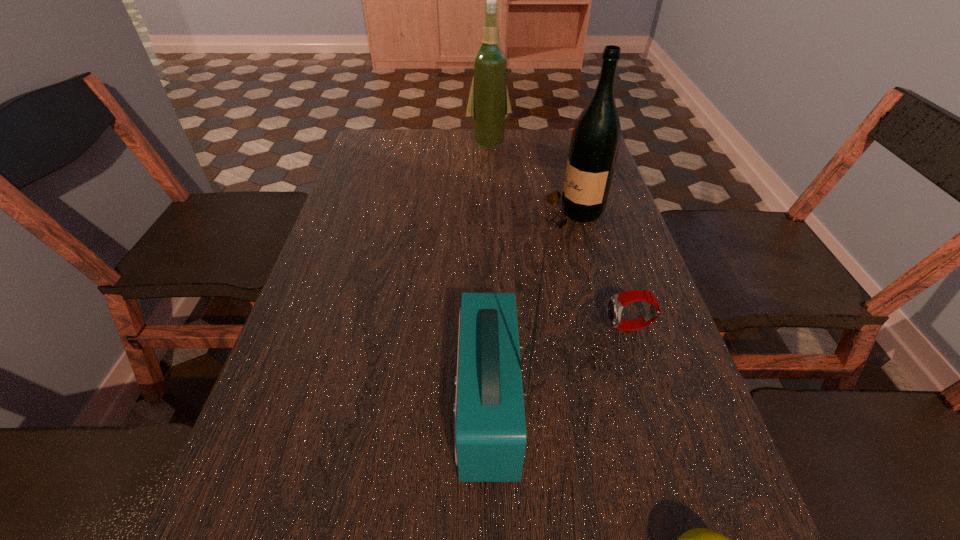
In the image, there is a desktop. At what (x,y) coordinates should I click in order to perform the action: click on blank space at the left edge. Please return your answer as a coordinate pair (x, y). Image resolution: width=960 pixels, height=540 pixels. Looking at the image, I should click on (310, 453).

At what (x,y) coordinates should I click in order to perform the action: click on free space at the right edge. Please return your answer as a coordinate pair (x, y). Image resolution: width=960 pixels, height=540 pixels. Looking at the image, I should click on (708, 500).

Locate an element on the screen. This screenshot has height=540, width=960. vacant space at the far right corner of the desktop is located at coordinates (563, 134).

This screenshot has width=960, height=540. Identify the location of free space between the right wine bottle and the farthest object. (531, 179).

Find the location of a particular element. free space that is in between the third farthest object and the left wine bottle is located at coordinates (559, 236).

You are a GUI agent. You are given a task and a screenshot of the screen. Output one action in this format:
    pyautogui.click(x=<x>, y=<y>)
    Task: Click on the empty space that is in between the nearer wine bottle and the left wine bottle
    
    Given the screenshot: What is the action you would take?
    pyautogui.click(x=531, y=179)

The width and height of the screenshot is (960, 540). Identify the location of free area in between the farthest object and the nearer wine bottle. (531, 179).

Identify the location of unoccupied position between the farthest object and the third farthest object. The width and height of the screenshot is (960, 540). (559, 236).

Locate an element on the screen. free spot between the second nearest object and the right wine bottle is located at coordinates (531, 309).

Where is `free space that is in between the watch and the radio receiver`? free space that is in between the watch and the radio receiver is located at coordinates (559, 366).